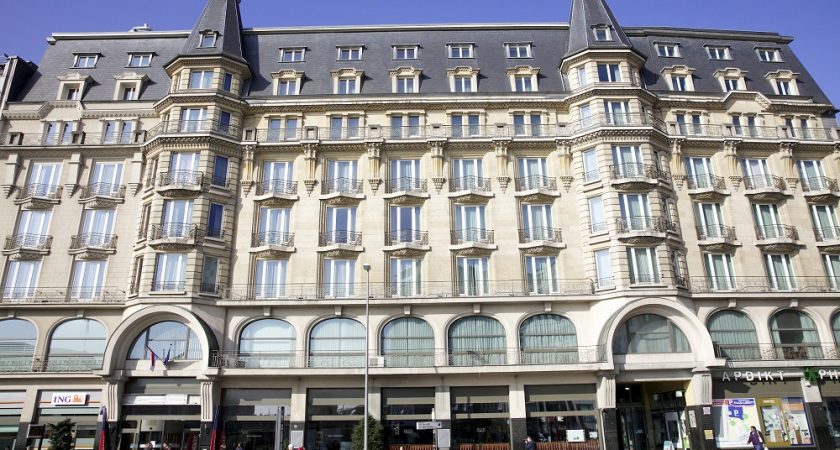
You are a GUI agent. You are given a task and a screenshot of the screen. Output one action in this format:
    pyautogui.click(x=<x>, y=<y>)
    Task: Click on the doors
    
    Given the screenshot: What is the action you would take?
    pyautogui.click(x=156, y=444), pyautogui.click(x=643, y=420)